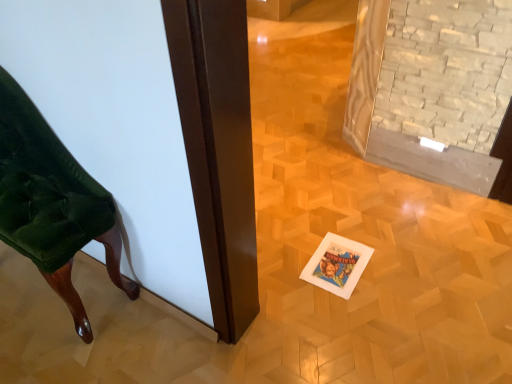
This screenshot has width=512, height=384. I want to click on free space in front of velvet green chair at left, so click(x=47, y=346).